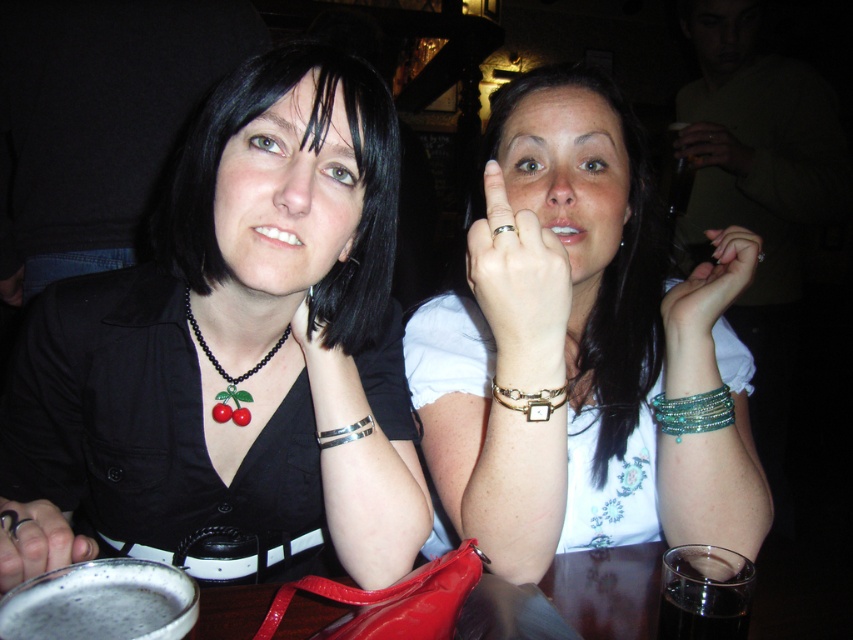
You are a photographer adjusting your camera settings to focus on the black matte necklace at center and the gold metallic ring at upper center. Which object should you focus on first to ensure both are in sharp focus?

You should focus on the gold metallic ring at upper center first because it is positioned above the black matte necklace at center, so adjusting focus starting from the higher object will help capture both in sharpness.

You are designing a layout for a jewelry display case and need to place the gold metallic ring at upper center and the metallic ring at lower left. Based on their sizes, which ring should be placed in a more prominent position to ensure visibility?

The metallic ring at lower left should be placed in a more prominent position because it occupies more space than the gold metallic ring at upper center, making it more noticeable.

You are a photographer adjusting your camera settings. You notice the gold metallic ring at upper center and the dark glass at lower right. Which object is closer to the camera lens?

The gold metallic ring at upper center is closer to the camera lens because it is in front of the dark glass at lower right.